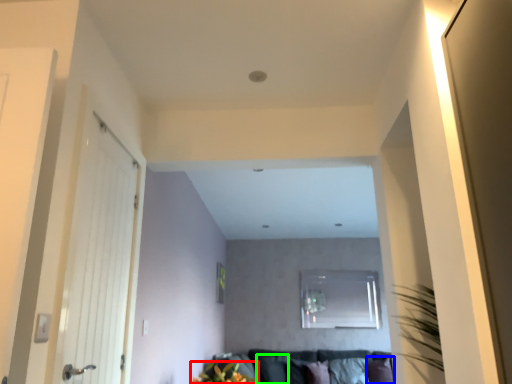
Question: Estimate the real-world distances between objects in this image. Which object is closer to floral arrangement (highlighted by a red box), pillow (highlighted by a blue box) or pillow (highlighted by a green box)?

Choices:
 (A) pillow
 (B) pillow

Answer: (B)